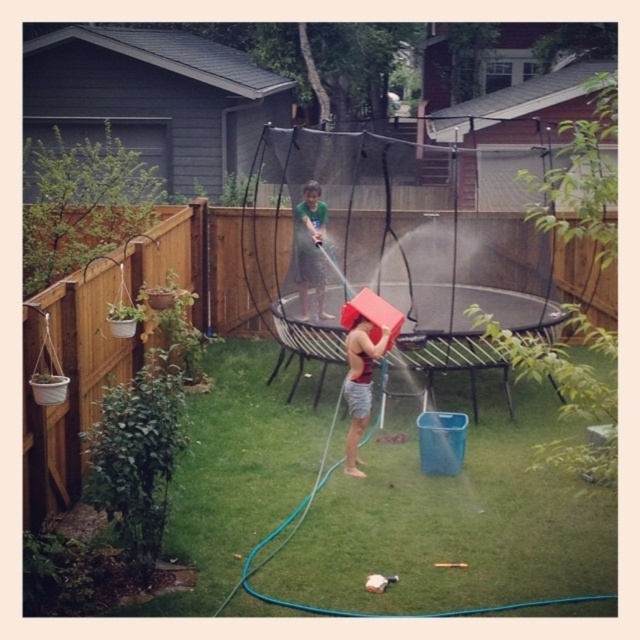
You are planning to place a new decorative item in the backyard. The item is 1.2 meters wide. You have two options to place it either where the matte red bucket at center is currently located or where the green fabric shirt at center is. Which location would be more suitable for the item based on the existing space?

The green fabric shirt at center location is more suitable because the existing object there has a larger width than the matte red bucket at center. Since the new item is 1.2 meters wide, placing it where the green fabric shirt at center is would have more space to accommodate the width.

You are standing in the backyard and want to place a small potted plant between the two points, point [349,435] and point [296,252]. Which point should you start from to ensure the plant is closer to the trampoline?

Point [296,252] is farther from the viewer than point [349,435]. Therefore, starting from point [296,252] would place the plant closer to the trampoline since it is behind the closer point.